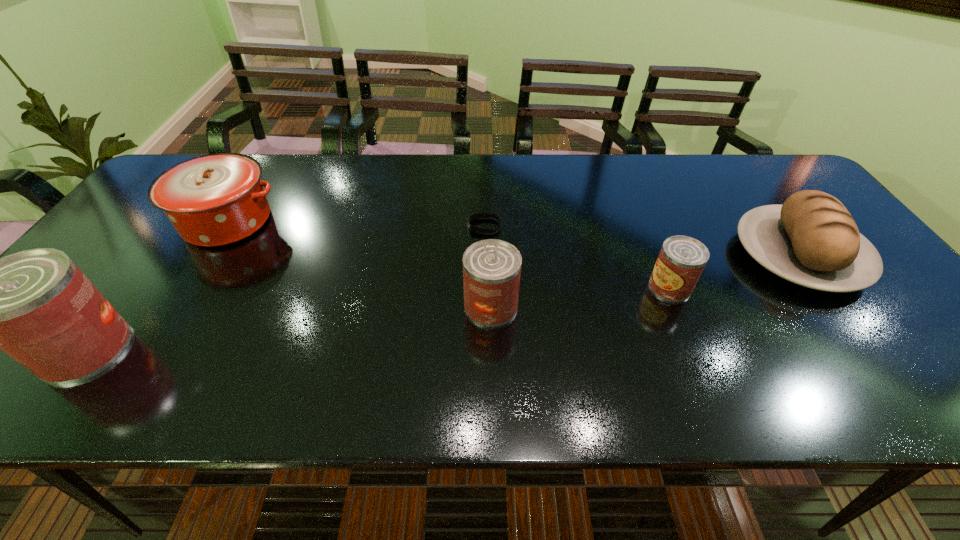
To make them evenly spaced by inserting another can among them, please locate a free space for this new can. Please provide its 2D coordinates. Your answer should be formatted as a tuple, i.e. [(x, y)], where the tuple contains the x and y coordinates of a point satisfying the conditions above.

[(297, 327)]